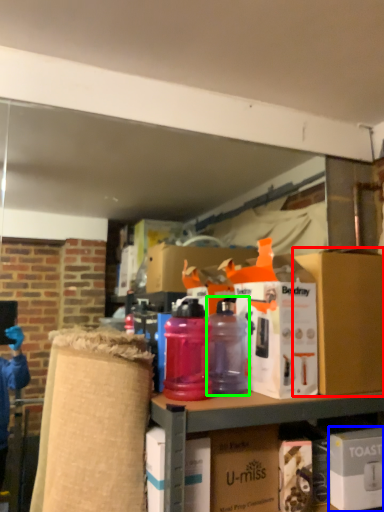
Question: Which is nearer to the box (highlighted by a red box)? box (highlighted by a blue box) or bottle (highlighted by a green box).

Choices:
 (A) box
 (B) bottle

Answer: (A)